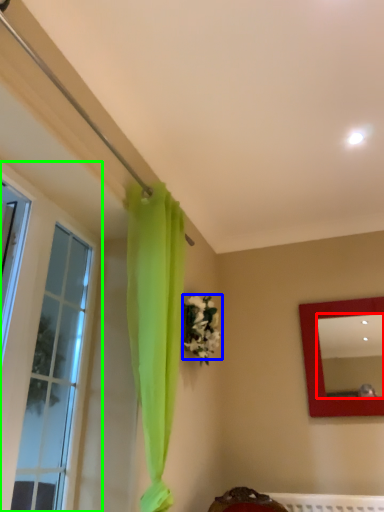
Question: Based on their relative distances, which object is farther from mirror (highlighted by a red box)? Choose from flower (highlighted by a blue box) and window (highlighted by a green box).

Choices:
 (A) flower
 (B) window

Answer: (B)